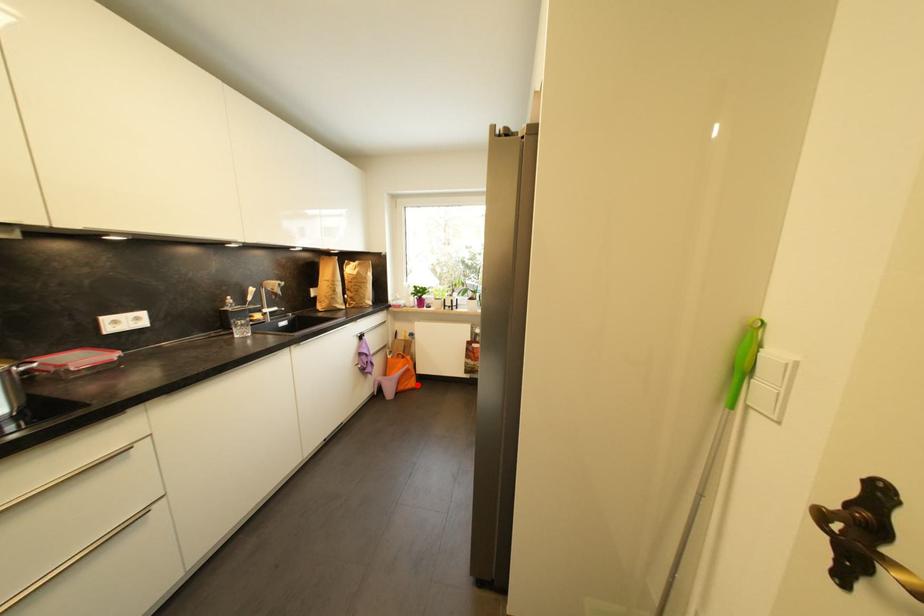
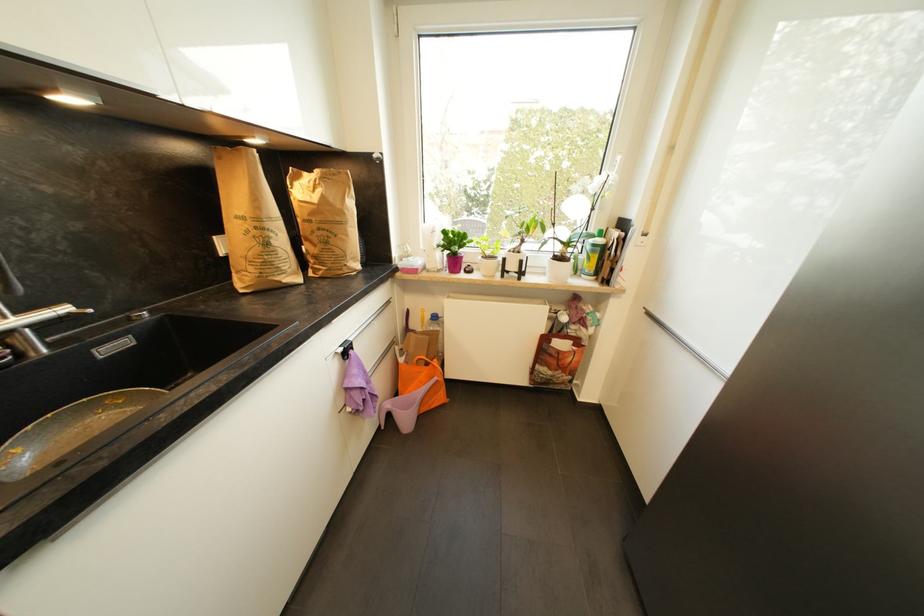
In the second image, find the point that corresponds to the highlighted location in the first image.

(445, 399)